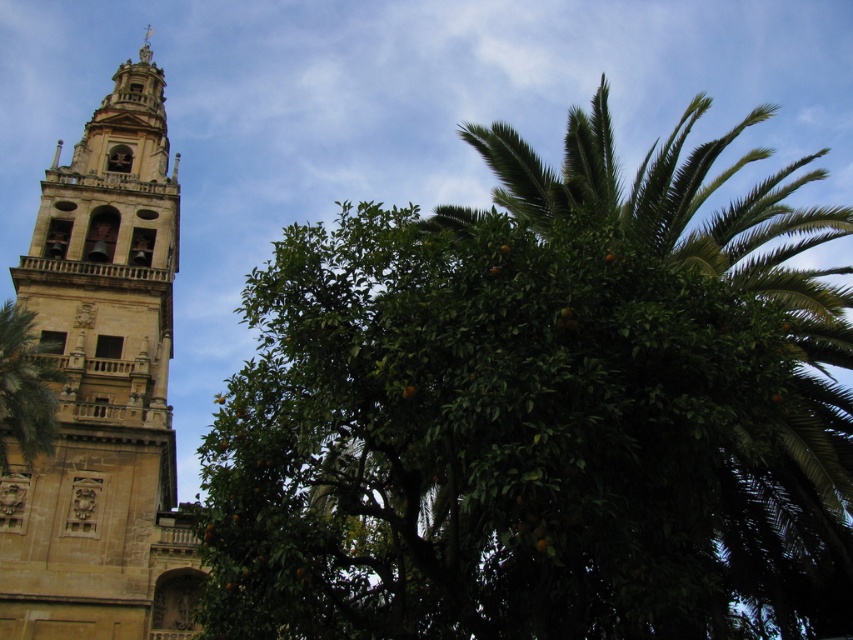
Between point (283, 540) and point (74, 284), which one is positioned in front?

Point (283, 540) is more forward.

Which is behind, point (618, 369) or point (32, 264)?

Positioned behind is point (32, 264).

Locate an element on the screen. green leafy orange tree at center is located at coordinates (541, 412).

Does beige stone tower at left appear over green leafy palm tree at left?

Correct, beige stone tower at left is located above green leafy palm tree at left.

Does point (44, 557) lie in front of point (50, 376)?

Yes, point (44, 557) is in front of point (50, 376).

Locate an element on the screen. The height and width of the screenshot is (640, 853). beige stone tower at left is located at coordinates (103, 388).

Does point (642, 602) come in front of point (28, 358)?

Yes.

Is green leafy orange tree at center to the right of green leafy palm tree at left from the viewer's perspective?

Yes, green leafy orange tree at center is to the right of green leafy palm tree at left.

Between point (730, 216) and point (16, 394), which one is positioned in front?

Positioned in front is point (16, 394).

Locate an element on the screen. The height and width of the screenshot is (640, 853). green leafy orange tree at center is located at coordinates (541, 412).